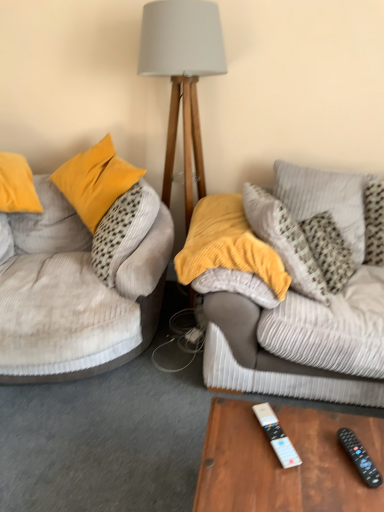
Question: Is light gray fabric lampshade at center to the right of velvety yellow pillow at center, which is the first pillow from left to right, from the viewer's perspective?

Choices:
 (A) yes
 (B) no

Answer: (B)

Question: From a real-world perspective, is light gray fabric lampshade at center on velvety yellow pillow at center, the second pillow from the right?

Choices:
 (A) yes
 (B) no

Answer: (A)

Question: Can you confirm if light gray fabric lampshade at center is smaller than velvety yellow pillow at center, the second pillow from the right?

Choices:
 (A) yes
 (B) no

Answer: (B)

Question: From a real-world perspective, does light gray fabric lampshade at center sit lower than velvety yellow pillow at center, the second pillow from the right?

Choices:
 (A) yes
 (B) no

Answer: (B)

Question: Considering the relative sizes of light gray fabric lampshade at center and velvety yellow pillow at center, the second pillow from the right, in the image provided, is light gray fabric lampshade at center taller than velvety yellow pillow at center, the second pillow from the right,?

Choices:
 (A) no
 (B) yes

Answer: (B)

Question: Based on their positions, is velvet beige couch at left located to the left or right of wooden table at lower center?

Choices:
 (A) left
 (B) right

Answer: (A)

Question: From a real-world perspective, is velvet beige couch at left physically located above or below wooden table at lower center?

Choices:
 (A) below
 (B) above

Answer: (B)

Question: From the image's perspective, relative to wooden table at lower center, is velvet beige couch at left above or below?

Choices:
 (A) below
 (B) above

Answer: (B)

Question: Choose the correct answer: Is velvet beige couch at left inside wooden table at lower center or outside it?

Choices:
 (A) outside
 (B) inside

Answer: (A)

Question: Is black plastic remote control at lower right, positioned as the 2th remote control in left-to-right order, situated inside white plastic remote control at lower center, which appears as the second remote control when viewed from the right, or outside?

Choices:
 (A) inside
 (B) outside

Answer: (B)

Question: Based on their positions, is black plastic remote control at lower right, the first remote control when ordered from right to left, located to the left or right of white plastic remote control at lower center, which appears as the second remote control when viewed from the right?

Choices:
 (A) left
 (B) right

Answer: (B)

Question: From a real-world perspective, relative to white plastic remote control at lower center, which appears as the second remote control when viewed from the right, is black plastic remote control at lower right, the first remote control when ordered from right to left, vertically above or below?

Choices:
 (A) below
 (B) above

Answer: (A)

Question: Considering the positions of black plastic remote control at lower right, positioned as the 2th remote control in left-to-right order, and white plastic remote control at lower center, which is counted as the first remote control, starting from the left, in the image, is black plastic remote control at lower right, positioned as the 2th remote control in left-to-right order, taller or shorter than white plastic remote control at lower center, which is counted as the first remote control, starting from the left,?

Choices:
 (A) tall
 (B) short

Answer: (A)

Question: Is point click(x=274, y=421) positioned closer to the camera than point click(x=350, y=442)?

Choices:
 (A) closer
 (B) farther

Answer: (B)

Question: From a real-world perspective, is white plastic remote control at lower center, which appears as the second remote control when viewed from the right, positioned above or below black plastic remote control at lower right, the first remote control when ordered from right to left?

Choices:
 (A) above
 (B) below

Answer: (A)